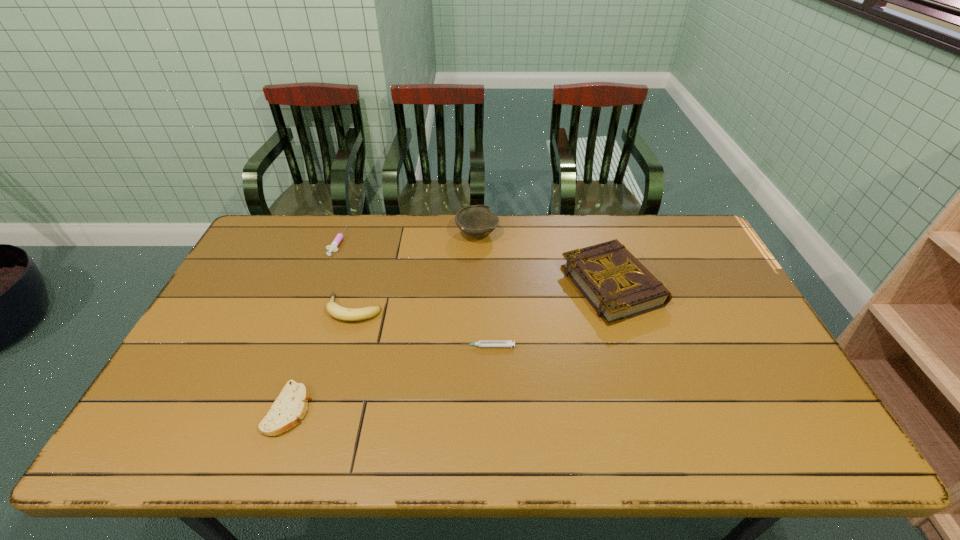
Locate an element on the screen. This screenshot has width=960, height=540. bowl is located at coordinates (476, 221).

Image resolution: width=960 pixels, height=540 pixels. I want to click on the rightmost object, so click(x=618, y=287).

What are the coordinates of `the fourth shortest object` in the screenshot? It's located at (346, 314).

You are a GUI agent. You are given a task and a screenshot of the screen. Output one action in this format:
    pyautogui.click(x=<x>, y=<y>)
    Task: Click on the farther syringe
    This screenshot has height=540, width=960.
    Given the screenshot: What is the action you would take?
    pyautogui.click(x=333, y=246)

Image resolution: width=960 pixels, height=540 pixels. What are the coordinates of `the left syringe` in the screenshot? It's located at (333, 246).

The height and width of the screenshot is (540, 960). Identify the location of the right syringe. (481, 343).

Locate an element on the screen. the second nearest object is located at coordinates (481, 343).

Where is `pita bread`? This screenshot has height=540, width=960. pita bread is located at coordinates (290, 406).

The height and width of the screenshot is (540, 960). I want to click on free space located on the right of the bowl, so click(x=578, y=234).

The image size is (960, 540). In order to click on vacant space located on the left of the hardback book in this screenshot , I will do pos(526,286).